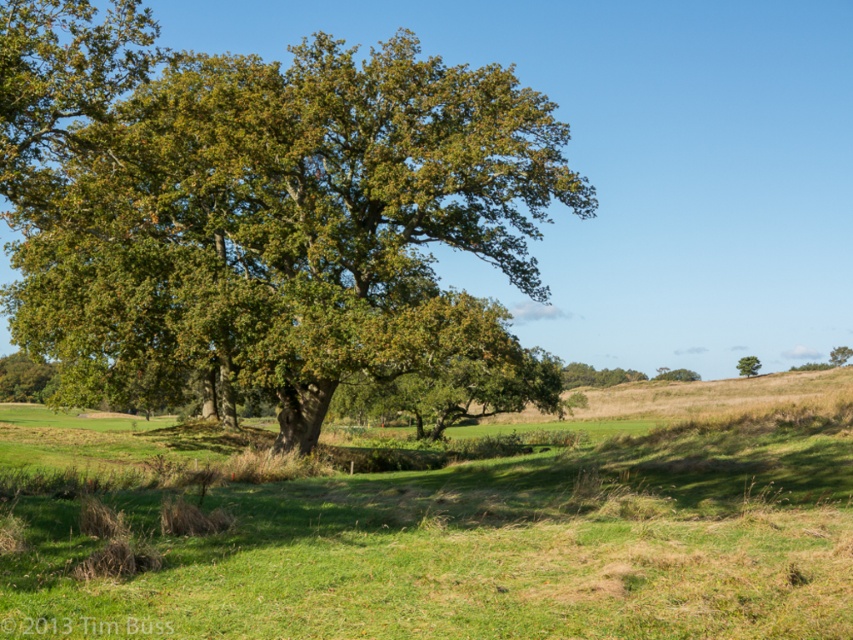
Question: Is green leafy oak tree at upper left behind green leafy tree at upper center?

Choices:
 (A) yes
 (B) no

Answer: (B)

Question: Which object is closer to the camera taking this photo?

Choices:
 (A) green leafy oak tree at upper left
 (B) green leafy tree at upper center

Answer: (A)

Question: Which object is the farthest from the green leafy tree at upper center?

Choices:
 (A) green leafy oak tree at upper left
 (B) green matte tree at right

Answer: (A)

Question: Which point is closer to the camera taking this photo?

Choices:
 (A) (833, 358)
 (B) (750, 365)
 (C) (62, 256)

Answer: (C)

Question: Is green leafy oak tree at upper left to the right of green leafy tree at upper center from the viewer's perspective?

Choices:
 (A) no
 (B) yes

Answer: (A)

Question: From the image, what is the correct spatial relationship of green leafy oak tree at upper left in relation to green leafy tree at upper center?

Choices:
 (A) right
 (B) left

Answer: (B)